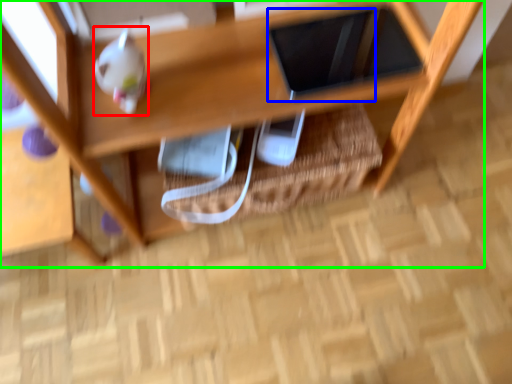
Question: Based on their relative distances, which object is nearer to toy (highlighted by a red box)? Choose from tablet computer (highlighted by a blue box) and shelf (highlighted by a green box).

Choices:
 (A) tablet computer
 (B) shelf

Answer: (B)